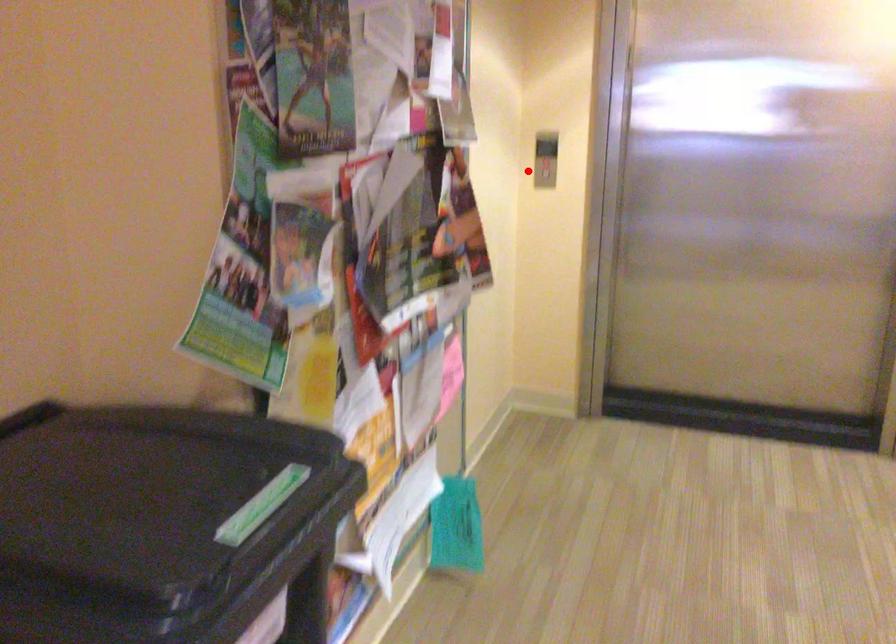
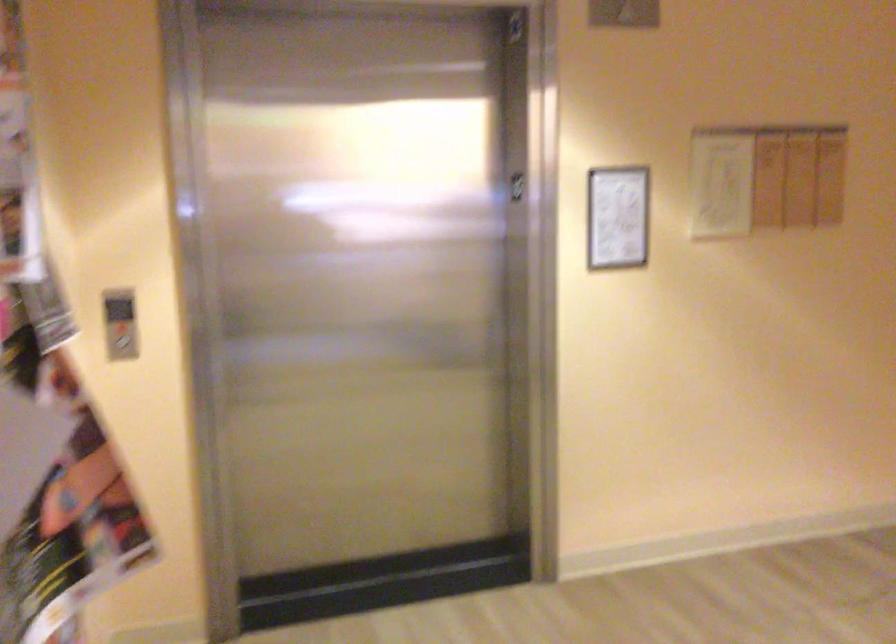
Locate, in the second image, the point that corresponds to the highlighted location in the first image.

(122, 343)